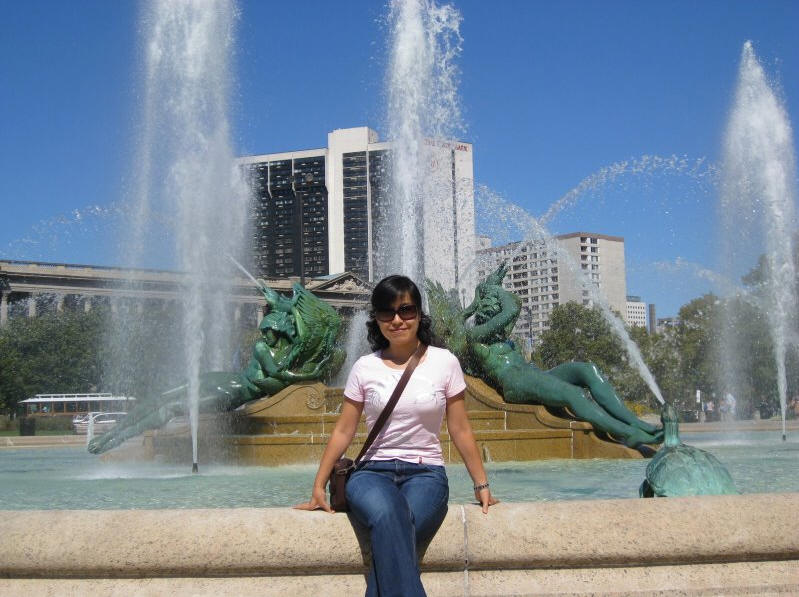
The height and width of the screenshot is (597, 799). I want to click on statue feet, so click(x=100, y=444), click(x=638, y=440), click(x=653, y=429).